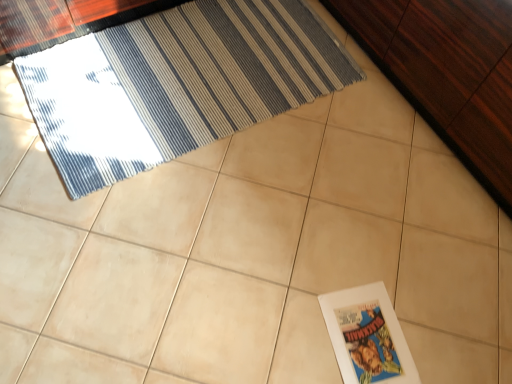
Image resolution: width=512 pixels, height=384 pixels. In order to click on vacant space underneath blue striped rug at upper left (from a real-world perspective) in this screenshot , I will do `click(178, 78)`.